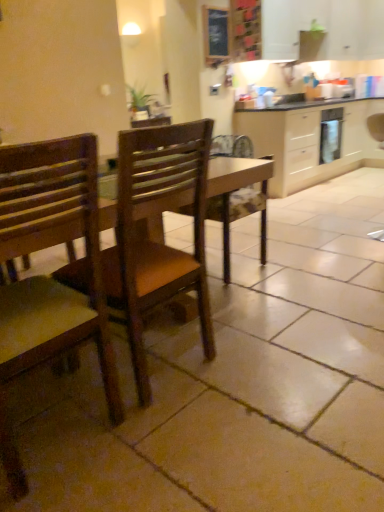
Question: Looking at their shapes, would you say wooden chair at center, which is the 1th chair in right-to-left order, is wider or thinner than beige wood cabinetry at upper right?

Choices:
 (A) wide
 (B) thin

Answer: (B)

Question: From their relative heights in the image, would you say wooden chair at center, which is the 1th chair in right-to-left order, is taller or shorter than beige wood cabinetry at upper right?

Choices:
 (A) tall
 (B) short

Answer: (B)

Question: Which is farther from the wooden chair at center, which is the 1th chair in right-to-left order?

Choices:
 (A) satin silver oven at right
 (B) wooden chair at left, the first chair when ordered from left to right
 (C) beige wood cabinetry at upper right
 (D) wooden frame at upper center

Answer: (A)

Question: Considering the real-world distances, which object is closest to the beige wood cabinetry at upper right?

Choices:
 (A) wooden chair at left, the first chair when ordered from left to right
 (B) wooden frame at upper center
 (C) satin silver oven at right
 (D) wooden chair at center, the second chair positioned from the left

Answer: (C)